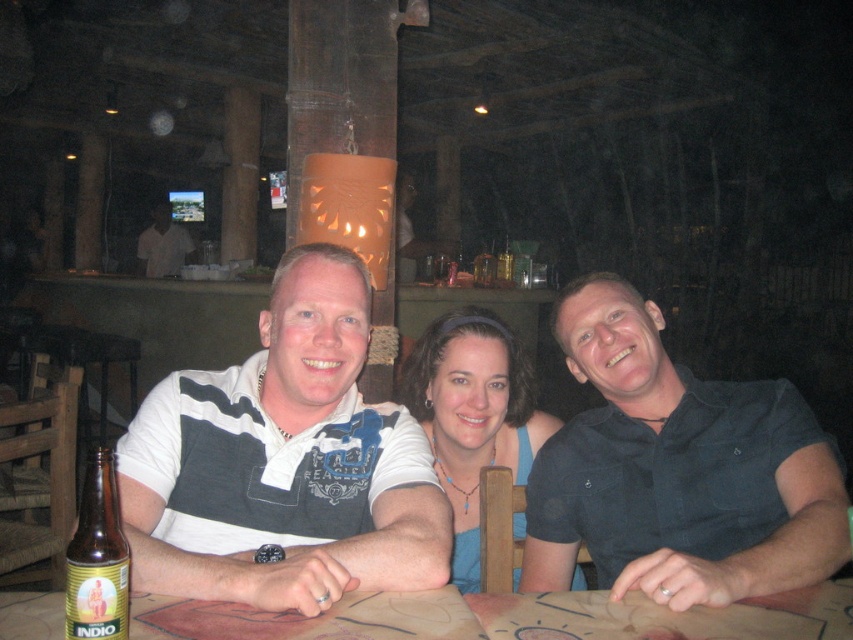
Question: Which object is the farthest from the white shirt at center?

Choices:
 (A) white striped polo shirt at center
 (B) blue fabric headband at center
 (C) dark blue shirt at center
 (D) wooden table at center

Answer: (D)

Question: Among these points, which one is farthest from the camera?

Choices:
 (A) (578, 595)
 (B) (511, 250)
 (C) (137, 486)
 (D) (820, 568)

Answer: (B)

Question: Which point is farther to the camera?

Choices:
 (A) (283, 628)
 (B) (514, 266)

Answer: (B)

Question: Considering the relative positions of dark blue shirt at center and brown glass bottle at lower left in the image provided, where is dark blue shirt at center located with respect to brown glass bottle at lower left?

Choices:
 (A) right
 (B) left

Answer: (A)

Question: Can you confirm if dark blue shirt at center is positioned below wooden table at center?

Choices:
 (A) no
 (B) yes

Answer: (A)

Question: Can you confirm if blue fabric headband at center is positioned to the right of brown glass bottle at lower left?

Choices:
 (A) yes
 (B) no

Answer: (A)